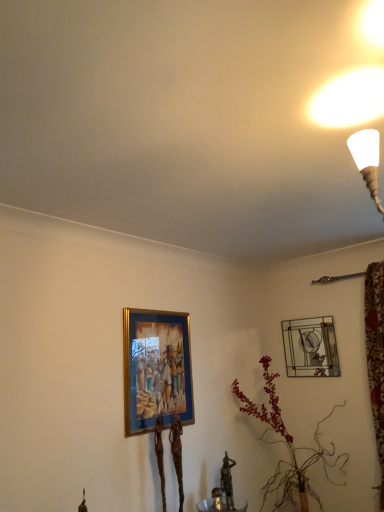
Question: From a real-world perspective, is leather-like plant at center-right beneath gold-framed painting at lower left, the 2th picture frame in the right-to-left sequence?

Choices:
 (A) yes
 (B) no

Answer: (A)

Question: Is leather-like plant at center-right to the left of gold-framed painting at lower left, which is the first picture frame in left-to-right order, from the viewer's perspective?

Choices:
 (A) no
 (B) yes

Answer: (A)

Question: Does leather-like plant at center-right have a greater width compared to gold-framed painting at lower left, which appears as the 2th picture frame when viewed from the back?

Choices:
 (A) yes
 (B) no

Answer: (A)

Question: Considering the relative positions of leather-like plant at center-right and gold-framed painting at lower left, the first picture frame from the front, in the image provided, is leather-like plant at center-right behind gold-framed painting at lower left, the first picture frame from the front,?

Choices:
 (A) no
 (B) yes

Answer: (B)

Question: Does leather-like plant at center-right come in front of gold-framed painting at lower left, which appears as the 2th picture frame when viewed from the back?

Choices:
 (A) no
 (B) yes

Answer: (A)

Question: Could you tell me if leather-like plant at center-right is turned towards gold-framed painting at lower left, the first picture frame from the front?

Choices:
 (A) no
 (B) yes

Answer: (A)

Question: Is gold-framed painting at lower left, the first picture frame from the front, at the right side of leather-like plant at center-right?

Choices:
 (A) yes
 (B) no

Answer: (B)

Question: Is the position of gold-framed painting at lower left, which is the first picture frame in left-to-right order, more distant than that of leather-like plant at center-right?

Choices:
 (A) yes
 (B) no

Answer: (B)

Question: Can you confirm if gold-framed painting at lower left, the 2th picture frame in the right-to-left sequence, is shorter than leather-like plant at center-right?

Choices:
 (A) no
 (B) yes

Answer: (B)

Question: Can you confirm if gold-framed painting at lower left, which appears as the 2th picture frame when viewed from the back, is wider than leather-like plant at center-right?

Choices:
 (A) yes
 (B) no

Answer: (B)

Question: Considering the relative sizes of gold-framed painting at lower left, the 2th picture frame in the right-to-left sequence, and leather-like plant at center-right in the image provided, is gold-framed painting at lower left, the 2th picture frame in the right-to-left sequence, bigger than leather-like plant at center-right?

Choices:
 (A) no
 (B) yes

Answer: (A)

Question: Does gold-framed painting at lower left, the first picture frame from the front, have a smaller size compared to leather-like plant at center-right?

Choices:
 (A) yes
 (B) no

Answer: (A)

Question: Is leather-like plant at center-right further to camera compared to metallic glass picture frame at upper right, the 2th picture frame when ordered from front to back?

Choices:
 (A) yes
 (B) no

Answer: (B)